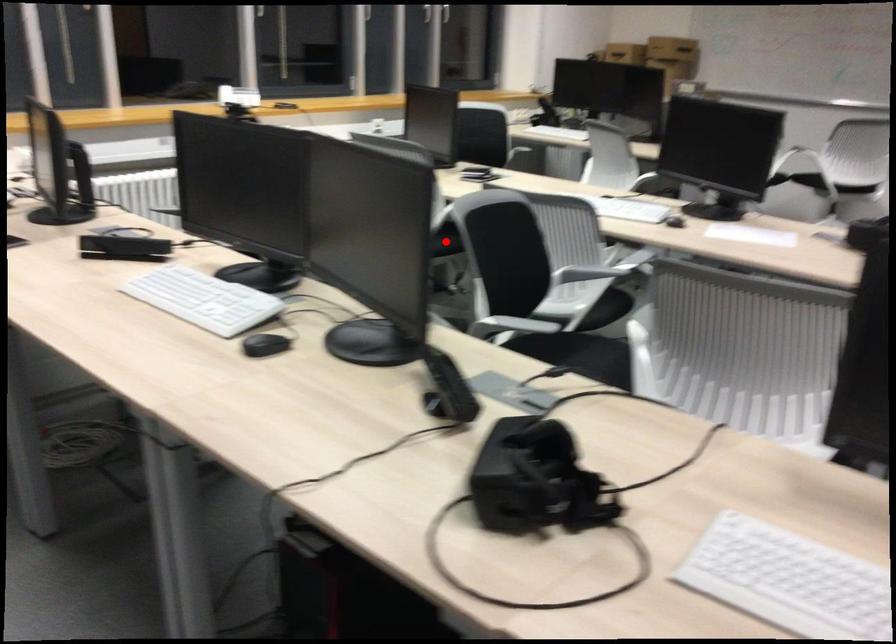
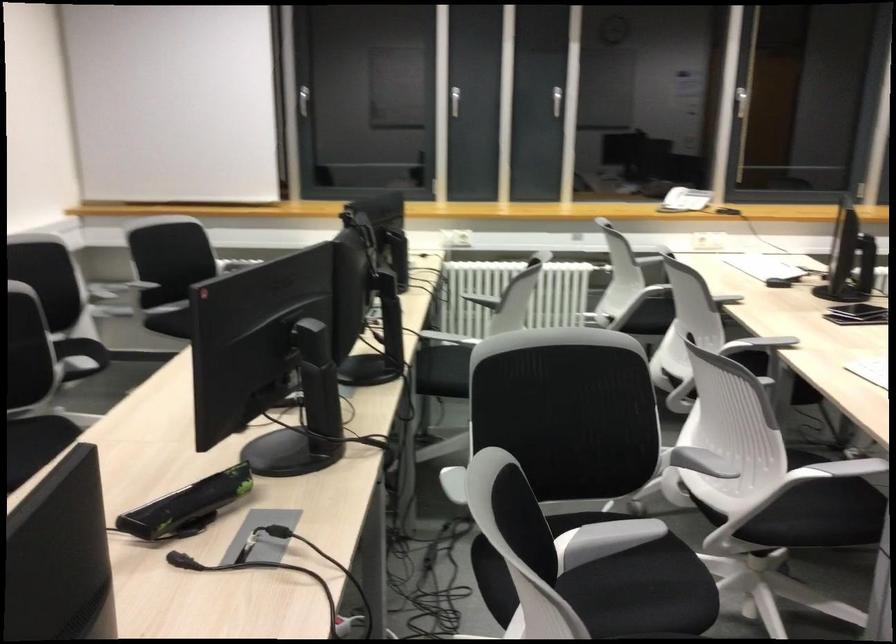
Question: I am providing you with two images of the same scene from different viewpoints. A red point is marked on the first image. At the location where the point appears in image 1, is it still visible in image 2?

Choices:
 (A) Yes
 (B) No

Answer: (B)